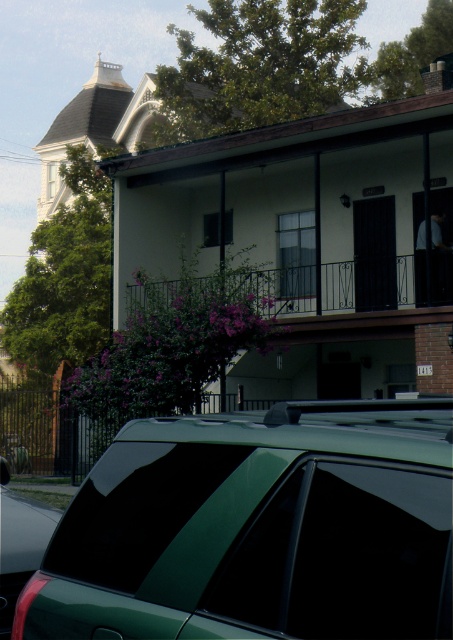
Which is more to the left, green matte car at lower center or metallic green car at lower left?

From the viewer's perspective, metallic green car at lower left appears more on the left side.

Is green matte car at lower center thinner than metallic green car at lower left?

No.

This screenshot has width=453, height=640. What do you see at coordinates (258, 529) in the screenshot? I see `green matte car at lower center` at bounding box center [258, 529].

Locate an element on the screen. The width and height of the screenshot is (453, 640). green matte car at lower center is located at coordinates (258, 529).

Is green matte car at lower center wider than iron black balcony at center?

Yes, green matte car at lower center is wider than iron black balcony at center.

Is point (157, 637) positioned before point (332, 269)?

Yes, point (157, 637) is closer to viewer.

I want to click on green matte car at lower center, so click(258, 529).

Is point (346, 288) farther from viewer compared to point (43, 538)?

Yes, point (346, 288) is farther from viewer.

Who is more forward, (414, 253) or (4, 477)?

Point (4, 477)

The image size is (453, 640). Find the location of `iron black balcony at center`. iron black balcony at center is located at coordinates (343, 285).